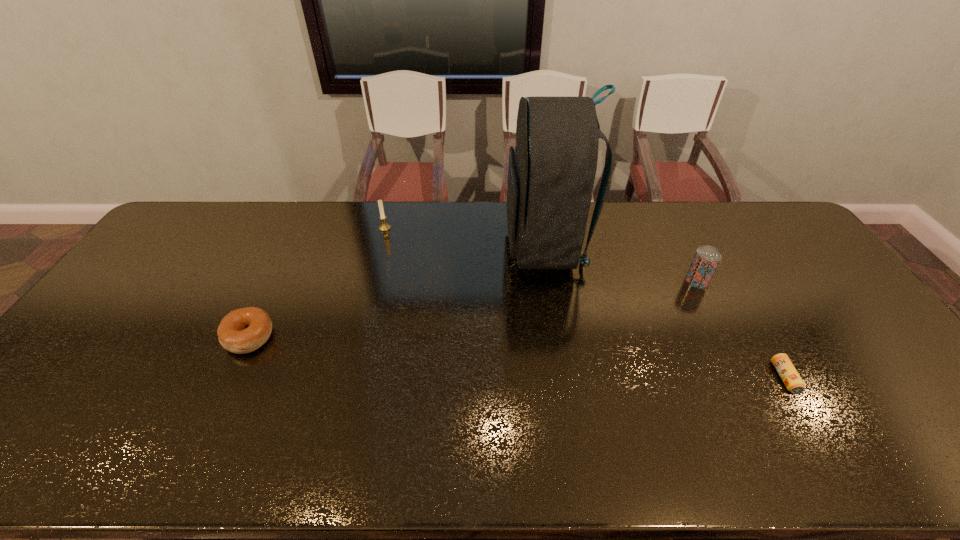
Locate an element on the screen. Image resolution: width=960 pixels, height=540 pixels. backpack is located at coordinates (551, 173).

This screenshot has height=540, width=960. Identify the location of the tallest object. (551, 173).

Locate an element on the screen. candle holder is located at coordinates (384, 227).

You are a GUI agent. You are given a task and a screenshot of the screen. Output one action in this format:
    pyautogui.click(x=<x>, y=<y>)
    Task: Click on the fourth object from left to right
    The height and width of the screenshot is (540, 960).
    Given the screenshot: What is the action you would take?
    pyautogui.click(x=706, y=260)

Find the location of a particular element. The width and height of the screenshot is (960, 540). the left beer can is located at coordinates (706, 260).

Where is `the second nearest object`? This screenshot has width=960, height=540. the second nearest object is located at coordinates (244, 330).

Locate an element on the screen. This screenshot has height=540, width=960. the leftmost object is located at coordinates (244, 330).

Where is `the shorter beer can`? This screenshot has width=960, height=540. the shorter beer can is located at coordinates (786, 370).

You are a GUI agent. You are given a task and a screenshot of the screen. Output one action in this format:
    pyautogui.click(x=<x>, y=<y>)
    Task: Click on the shortest object
    The height and width of the screenshot is (540, 960).
    Given the screenshot: What is the action you would take?
    pyautogui.click(x=786, y=370)

The height and width of the screenshot is (540, 960). In order to click on vacant position located on the front-facing side of the third object from left to right in this screenshot , I will do `click(386, 245)`.